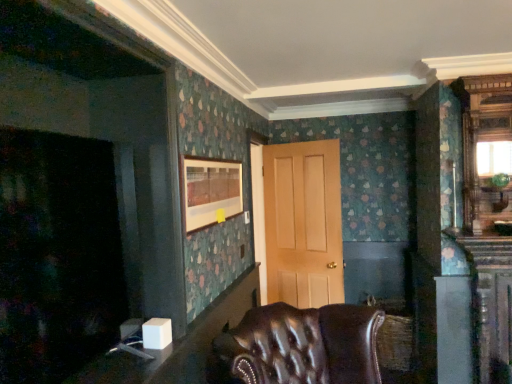
Question: Considering the relative sizes of matte wooden picture frame at upper center and white glossy table at lower left, placed as the 1th table when sorted from top to bottom, in the image provided, is matte wooden picture frame at upper center taller than white glossy table at lower left, placed as the 1th table when sorted from top to bottom,?

Choices:
 (A) yes
 (B) no

Answer: (A)

Question: Could you tell me if matte wooden picture frame at upper center is turned towards white glossy table at lower left, the 2th table in the bottom-to-top sequence?

Choices:
 (A) no
 (B) yes

Answer: (A)

Question: Does matte wooden picture frame at upper center have a lesser height compared to white glossy table at lower left, placed as the 1th table when sorted from top to bottom?

Choices:
 (A) yes
 (B) no

Answer: (B)

Question: From a real-world perspective, is matte wooden picture frame at upper center physically below white glossy table at lower left, placed as the 1th table when sorted from top to bottom?

Choices:
 (A) no
 (B) yes

Answer: (A)

Question: Is matte wooden picture frame at upper center positioned far away from white glossy table at lower left, the 2th table in the bottom-to-top sequence?

Choices:
 (A) yes
 (B) no

Answer: (B)

Question: In terms of width, does white glossy table at lower left, the 2th table in the bottom-to-top sequence, look wider or thinner when compared to leather tufted chair at lower center?

Choices:
 (A) thin
 (B) wide

Answer: (A)

Question: Is white glossy table at lower left, the 2th table in the bottom-to-top sequence, inside the boundaries of leather tufted chair at lower center, or outside?

Choices:
 (A) outside
 (B) inside

Answer: (A)

Question: From a real-world perspective, is white glossy table at lower left, placed as the 1th table when sorted from top to bottom, physically located above or below leather tufted chair at lower center?

Choices:
 (A) above
 (B) below

Answer: (A)

Question: Relative to leather tufted chair at lower center, is white glossy table at lower left, placed as the 1th table when sorted from top to bottom, in front or behind?

Choices:
 (A) front
 (B) behind

Answer: (B)

Question: Is white plastic table at lower left, the first table from the bottom, inside or outside of leather tufted chair at lower center?

Choices:
 (A) outside
 (B) inside

Answer: (A)

Question: Considering the positions of white plastic table at lower left, marked as the 2th table in a top-to-bottom arrangement, and leather tufted chair at lower center in the image, is white plastic table at lower left, marked as the 2th table in a top-to-bottom arrangement, wider or thinner than leather tufted chair at lower center?

Choices:
 (A) wide
 (B) thin

Answer: (B)

Question: From the image's perspective, is white plastic table at lower left, the first table from the bottom, located above or below leather tufted chair at lower center?

Choices:
 (A) below
 (B) above

Answer: (B)

Question: Does point (182, 352) appear closer or farther from the camera than point (216, 360)?

Choices:
 (A) farther
 (B) closer

Answer: (B)

Question: Is point (366, 359) positioned closer to the camera than point (297, 251)?

Choices:
 (A) farther
 (B) closer

Answer: (B)

Question: Relative to light brown wood door at center, is leather tufted chair at lower center in front or behind?

Choices:
 (A) front
 (B) behind

Answer: (A)